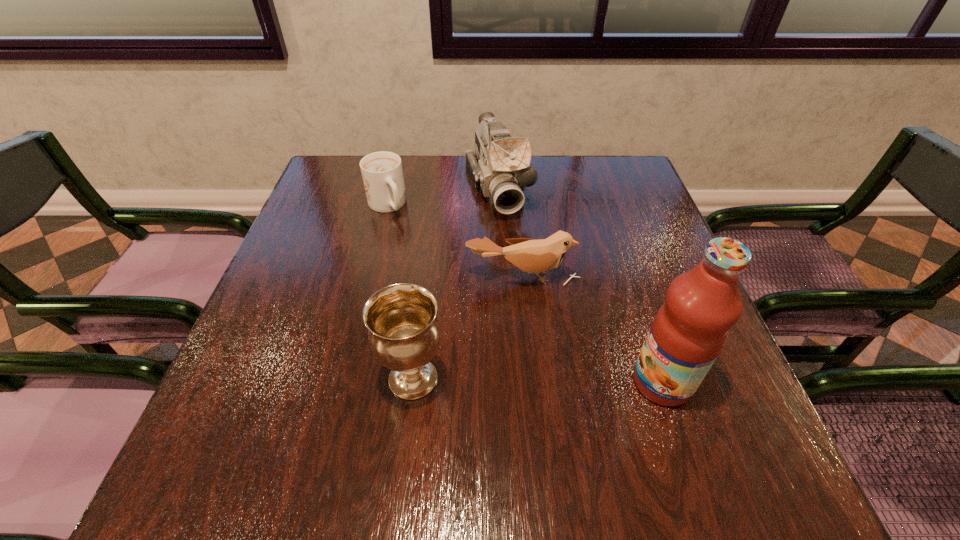
Where is `vacant area between the second object from left to right and the third nearest object`? The image size is (960, 540). vacant area between the second object from left to right and the third nearest object is located at coordinates (468, 328).

Identify the location of empty space between the leftmost object and the bird. The image size is (960, 540). (454, 241).

You are a GUI agent. You are given a task and a screenshot of the screen. Output one action in this format:
    pyautogui.click(x=<x>, y=<y>)
    Task: Click on the object that is the third nearest to the camcorder
    The width and height of the screenshot is (960, 540).
    Given the screenshot: What is the action you would take?
    pyautogui.click(x=404, y=333)

You are a GUI agent. You are given a task and a screenshot of the screen. Output one action in this format:
    pyautogui.click(x=<x>, y=<y>)
    Task: Click on the object that stands as the second closest to the second object from left to right
    This screenshot has height=540, width=960.
    Given the screenshot: What is the action you would take?
    pyautogui.click(x=690, y=329)

At what (x,y) coordinates should I click in order to perform the action: click on free space that satisfies the following two spatial constraints: 1. on the front side of the leftmost object; 2. on the left side of the third nearest object. Please return your answer as a coordinate pair (x, y). The width and height of the screenshot is (960, 540). Looking at the image, I should click on (369, 277).